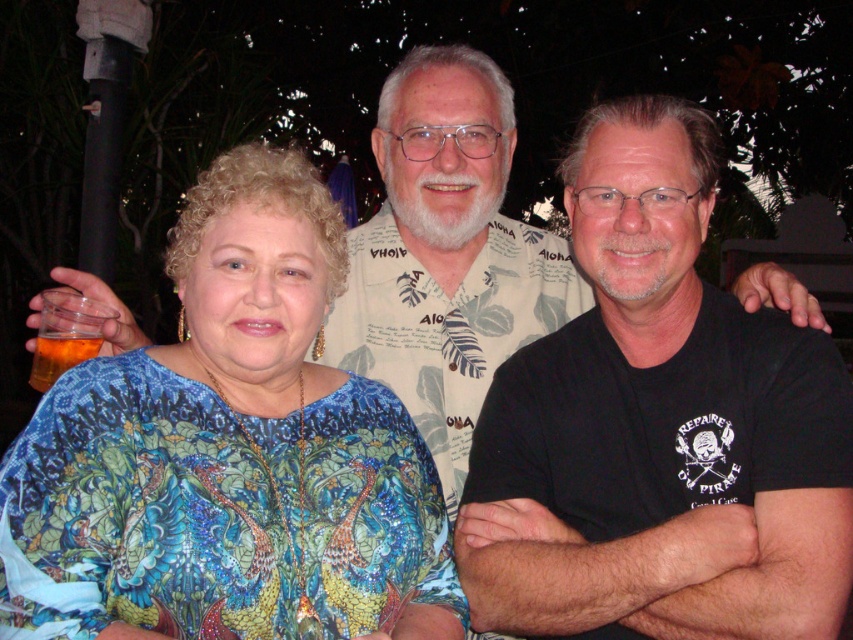
Question: Which object is the farthest from the printed cotton shirt at center?

Choices:
 (A) translucent plastic cup at lower left
 (B) black matte t-shirt at center
 (C) translucent amber glass at lower left
 (D) shiny blue blouse at center

Answer: (C)

Question: Is shiny blue blouse at center closer to camera compared to translucent amber glass at lower left?

Choices:
 (A) no
 (B) yes

Answer: (B)

Question: Which object is the farthest from the printed cotton shirt at center?

Choices:
 (A) translucent plastic cup at lower left
 (B) black matte t-shirt at center
 (C) translucent amber glass at lower left

Answer: (C)

Question: Which point is farther from the camera taking this photo?

Choices:
 (A) (399, 381)
 (B) (51, 316)

Answer: (A)

Question: Can you confirm if shiny blue blouse at center is positioned below printed cotton shirt at center?

Choices:
 (A) yes
 (B) no

Answer: (A)

Question: Is black matte t-shirt at center further to the viewer compared to translucent amber glass at lower left?

Choices:
 (A) no
 (B) yes

Answer: (A)